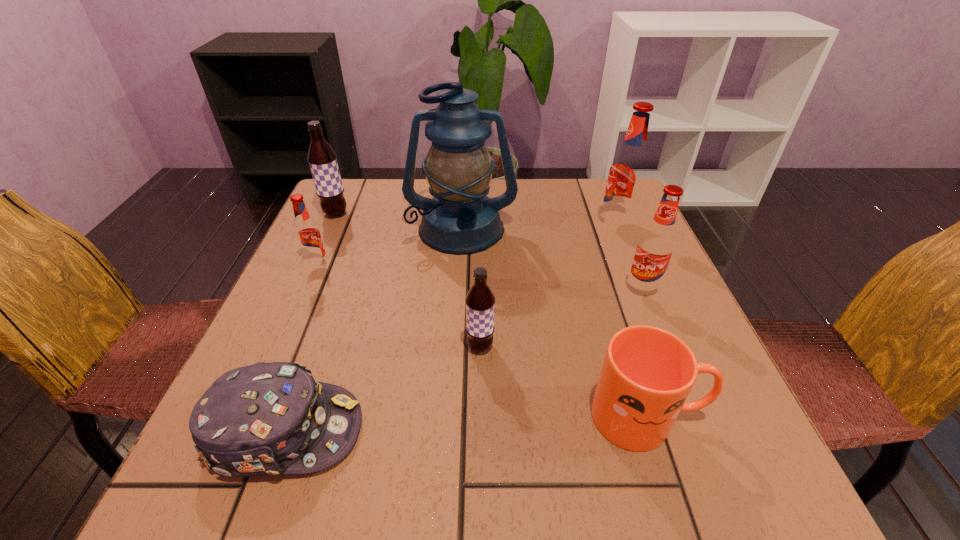
Identify which red root beer is the closest to the farthest red root beer. Please provide its 2D coordinates. Your answer should be formatted as a tuple, i.e. [(x, y)], where the tuple contains the x and y coordinates of a point satisfying the conditions above.

[(656, 245)]

The width and height of the screenshot is (960, 540). I want to click on the closest red root beer to the lantern, so click(308, 237).

This screenshot has height=540, width=960. Find the location of `free spot that satisfies the following two spatial constraints: 1. on the face of the smaller brown root beer; 2. on the left side of the lantern`. free spot that satisfies the following two spatial constraints: 1. on the face of the smaller brown root beer; 2. on the left side of the lantern is located at coordinates (455, 347).

You are a GUI agent. You are given a task and a screenshot of the screen. Output one action in this format:
    pyautogui.click(x=<x>, y=<y>)
    Task: Click on the free location that satisfies the following two spatial constraints: 1. on the face of the lantern; 2. on the left side of the fifth farthest object
    Image resolution: width=960 pixels, height=540 pixels.
    Given the screenshot: What is the action you would take?
    pyautogui.click(x=458, y=290)

At what (x,y) coordinates should I click in order to perform the action: click on free point that satisfies the following two spatial constraints: 1. on the face of the blue lantern; 2. on the front-facing side of the headwear. Please return your answer as a coordinate pair (x, y). Image resolution: width=960 pixels, height=540 pixels. Looking at the image, I should click on (450, 430).